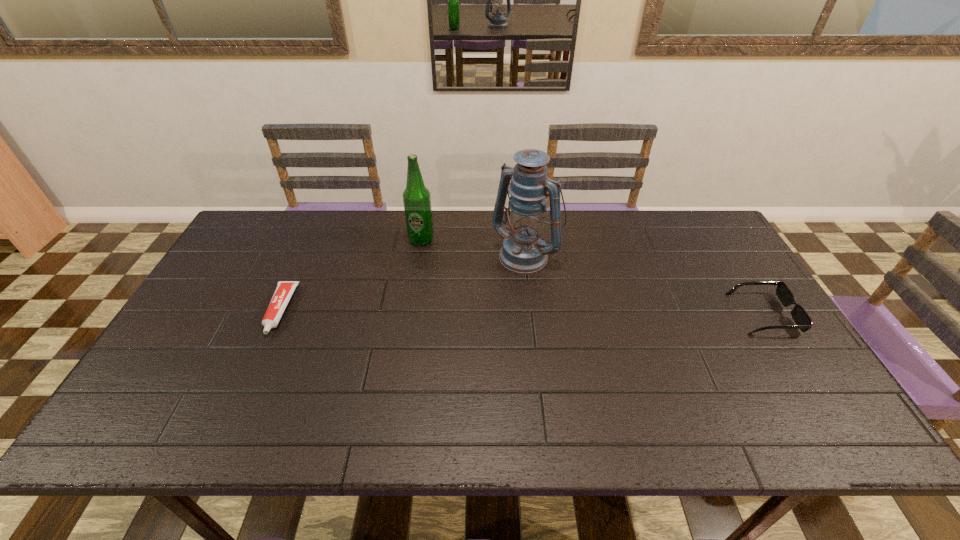
Where is `vacant space on the desktop that is between the shortest object and the third tallest object and is positioned on the front-facing side of the tallest object`? This screenshot has width=960, height=540. vacant space on the desktop that is between the shortest object and the third tallest object and is positioned on the front-facing side of the tallest object is located at coordinates (473, 312).

Find the location of a particular element. Image resolution: width=960 pixels, height=540 pixels. free space on the desktop that is between the shortest object and the sunglasses and is positioned on the label of the third object from right to left is located at coordinates (471, 312).